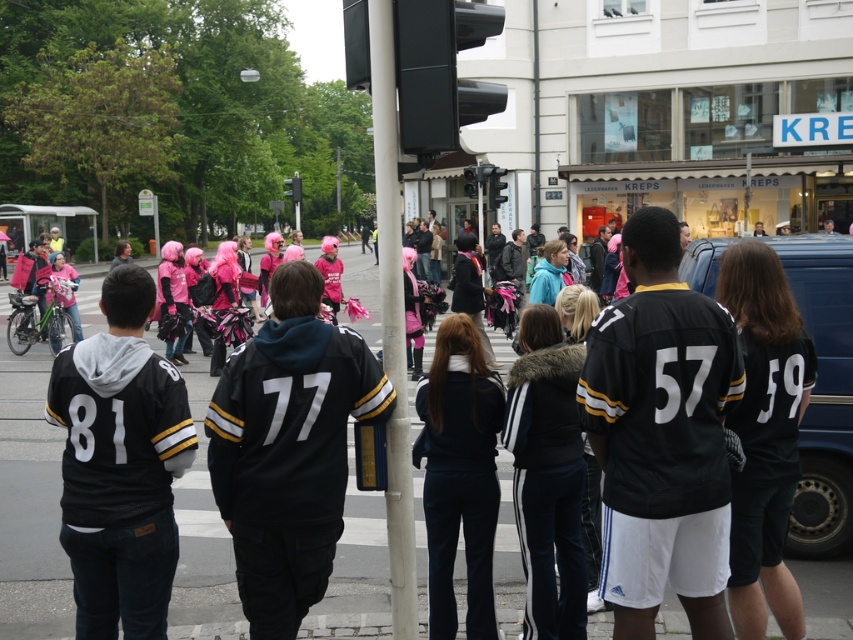
Question: Can you confirm if black leather jacket at center is wider than black jersey at center?

Choices:
 (A) yes
 (B) no

Answer: (A)

Question: Estimate the real-world distances between objects in this image. Which object is farther from the black leather jacket at center?

Choices:
 (A) matte pink helmet at left
 (B) black jersey at center

Answer: (A)

Question: Does dark blue fleece jacket at center appear on the left side of matte pink helmet at left?

Choices:
 (A) no
 (B) yes

Answer: (A)

Question: Is black jersey at center positioned at the back of white plastic pole at center?

Choices:
 (A) no
 (B) yes

Answer: (B)

Question: Which point is farther to the camera?

Choices:
 (A) black jersey at center
 (B) matte pink helmet at left
 (C) black leather jacket at center

Answer: (B)

Question: Which is farther from the black jersey at center?

Choices:
 (A) matte pink helmet at left
 (B) black leather jacket at center

Answer: (A)